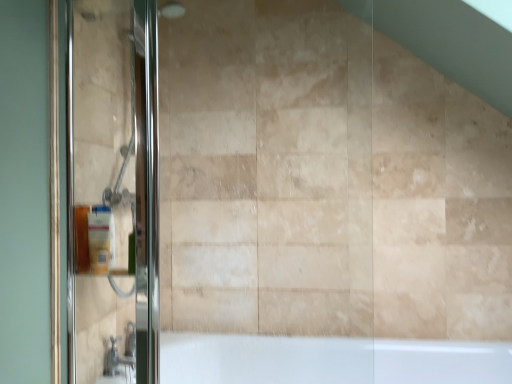
Question: Is matte silver faucet at lower left smaller than matte plastic soap dispenser at left?

Choices:
 (A) no
 (B) yes

Answer: (A)

Question: Is matte silver faucet at lower left oriented away from matte plastic soap dispenser at left?

Choices:
 (A) yes
 (B) no

Answer: (B)

Question: From a real-world perspective, is matte silver faucet at lower left on top of matte plastic soap dispenser at left?

Choices:
 (A) no
 (B) yes

Answer: (A)

Question: Is matte silver faucet at lower left shorter than matte plastic soap dispenser at left?

Choices:
 (A) no
 (B) yes

Answer: (B)

Question: From the image's perspective, would you say matte silver faucet at lower left is shown under matte plastic soap dispenser at left?

Choices:
 (A) yes
 (B) no

Answer: (A)

Question: Is matte silver faucet at lower left inside or outside of matte plastic soap dispenser at left?

Choices:
 (A) outside
 (B) inside

Answer: (A)

Question: Based on their sizes in the image, would you say matte silver faucet at lower left is bigger or smaller than matte plastic soap dispenser at left?

Choices:
 (A) big
 (B) small

Answer: (A)

Question: In terms of width, does matte silver faucet at lower left look wider or thinner when compared to matte plastic soap dispenser at left?

Choices:
 (A) wide
 (B) thin

Answer: (A)

Question: From the image's perspective, is matte silver faucet at lower left located above or below matte plastic soap dispenser at left?

Choices:
 (A) above
 (B) below

Answer: (B)

Question: From the image's perspective, is matte silver faucet at lower left above or below polished glass shower door at left?

Choices:
 (A) above
 (B) below

Answer: (B)

Question: From their relative heights in the image, would you say matte silver faucet at lower left is taller or shorter than polished glass shower door at left?

Choices:
 (A) tall
 (B) short

Answer: (B)

Question: In the image, is matte silver faucet at lower left on the left side or the right side of polished glass shower door at left?

Choices:
 (A) right
 (B) left

Answer: (B)

Question: Considering the positions of matte silver faucet at lower left and polished glass shower door at left in the image, is matte silver faucet at lower left bigger or smaller than polished glass shower door at left?

Choices:
 (A) small
 (B) big

Answer: (A)

Question: Looking at their shapes, would you say polished glass shower door at left is wider or thinner than matte silver faucet at lower left?

Choices:
 (A) wide
 (B) thin

Answer: (B)

Question: From a real-world perspective, is polished glass shower door at left physically located above or below matte silver faucet at lower left?

Choices:
 (A) below
 (B) above

Answer: (B)